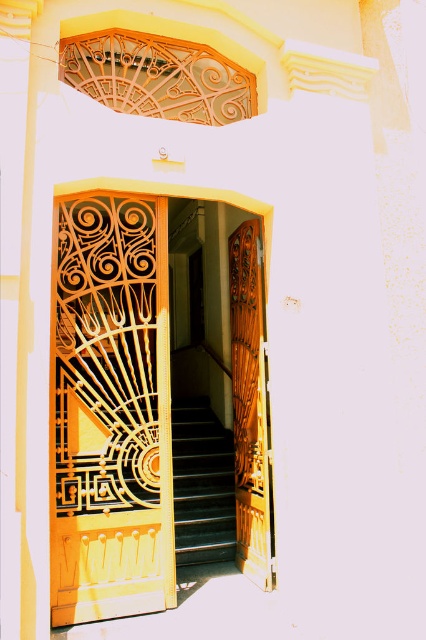
Can you confirm if golden wrought iron door at center is positioned below black glossy stairs at center?

No, golden wrought iron door at center is not below black glossy stairs at center.

Looking at this image, how far apart are golden wrought iron door at center and black glossy stairs at center?

golden wrought iron door at center and black glossy stairs at center are 6.92 feet apart from each other.

Which is behind, point (98, 282) or point (193, 561)?

Positioned behind is point (193, 561).

You are a GUI agent. You are given a task and a screenshot of the screen. Output one action in this format:
    pyautogui.click(x=<x>, y=<y>)
    Task: Click on the golden wrought iron door at center
    This screenshot has height=640, width=426.
    Given the screenshot: What is the action you would take?
    pyautogui.click(x=109, y=408)

Who is positioned more to the right, wooden carved door at center or black glossy stairs at center?

From the viewer's perspective, wooden carved door at center appears more on the right side.

Does wooden carved door at center appear on the left side of black glossy stairs at center?

No, wooden carved door at center is not to the left of black glossy stairs at center.

I want to click on wooden carved door at center, so click(250, 403).

Identify the location of wooden carved door at center. (250, 403).

This screenshot has width=426, height=640. What do you see at coordinates (109, 408) in the screenshot?
I see `golden wrought iron door at center` at bounding box center [109, 408].

Which of these two, golden wrought iron door at center or wooden carved door at center, stands shorter?

golden wrought iron door at center

Who is more forward, (109, 588) or (259, 356)?

Point (109, 588) is more forward.

This screenshot has height=640, width=426. Identify the location of golden wrought iron door at center. (109, 408).